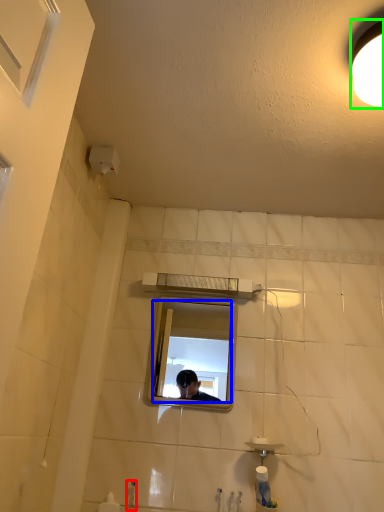
Question: Based on their relative distances, which object is nearer to faucet (highlighted by a red box)? Choose from mirror (highlighted by a blue box) and light fixture (highlighted by a green box).

Choices:
 (A) mirror
 (B) light fixture

Answer: (B)